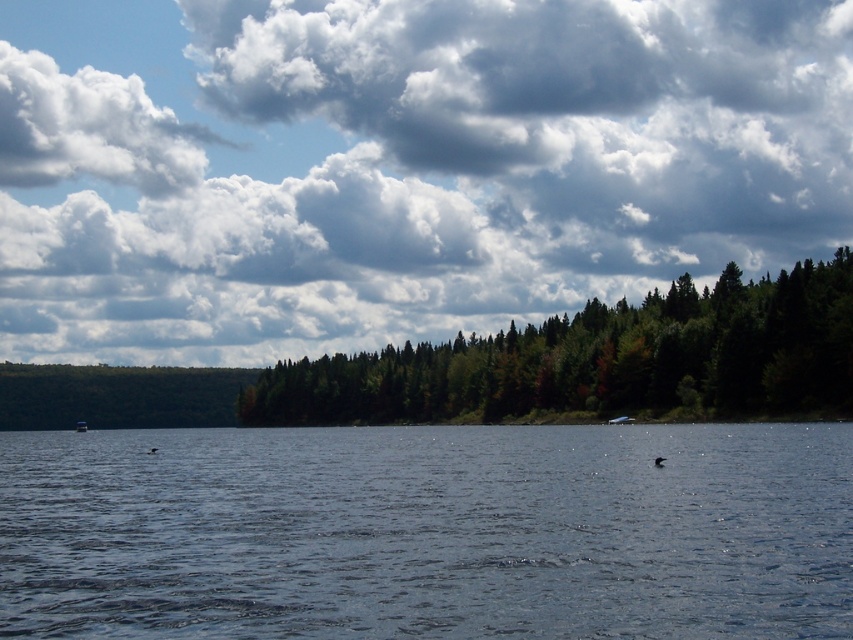
Between blue glossy boat at center and blue plastic boat at center, which one appears on the left side from the viewer's perspective?

blue plastic boat at center

Is blue glossy boat at center shorter than blue plastic boat at center?

Indeed, blue glossy boat at center has a lesser height compared to blue plastic boat at center.

I want to click on blue glossy boat at center, so click(x=621, y=419).

Is blue water at center above blue plastic boat at center?

Yes.

Who is shorter, blue water at center or blue plastic boat at center?

blue plastic boat at center is shorter.

Is point (659, 467) less distant than point (77, 428)?

Yes, it is in front of point (77, 428).

This screenshot has height=640, width=853. I want to click on blue water at center, so click(x=428, y=531).

Looking at this image, between cloudy sky at upper center and blue glossy boat at center, which one is positioned higher?

cloudy sky at upper center is higher up.

You are a GUI agent. You are given a task and a screenshot of the screen. Output one action in this format:
    pyautogui.click(x=<x>, y=<y>)
    Task: Click on the cloudy sky at upper center
    The width and height of the screenshot is (853, 640).
    Given the screenshot: What is the action you would take?
    pyautogui.click(x=397, y=164)